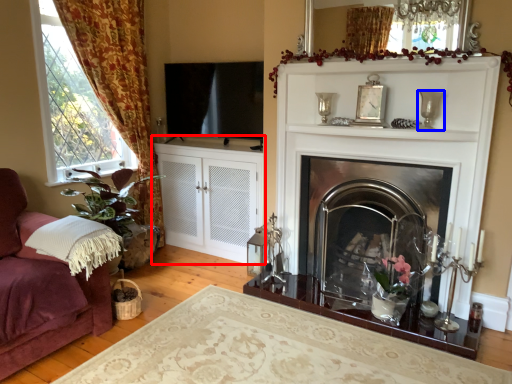
Question: Among these objects, which one is farthest to the camera, cabinetry (highlighted by a red box) or candle holder (highlighted by a blue box)?

Choices:
 (A) cabinetry
 (B) candle holder

Answer: (A)